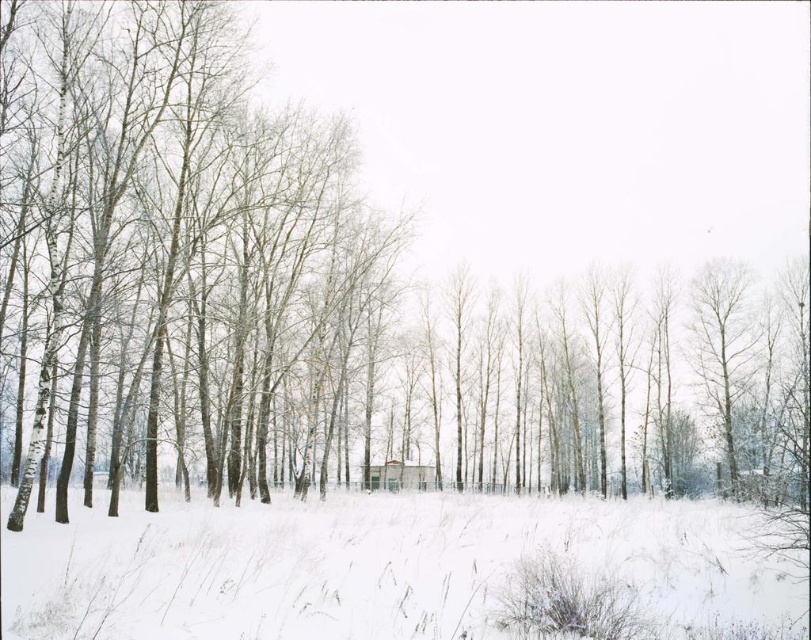
You are standing in the winter landscape and want to walk from the point closer to you to the point further away. Which path would you take between the two points, point (801,580) and point (402,467)?

The path from point (801,580) to point (402,467) requires moving away from the viewer since point (801,580) is closer than point (402,467).

You are standing in the winter landscape and want to place a small decorative snowman exactly at the point marked by coordinates point (384,568). According to the scene description, what will the snowman be placed on?

The point (384,568) marks white snow at center, so the snowman will be placed on the white snow at center.